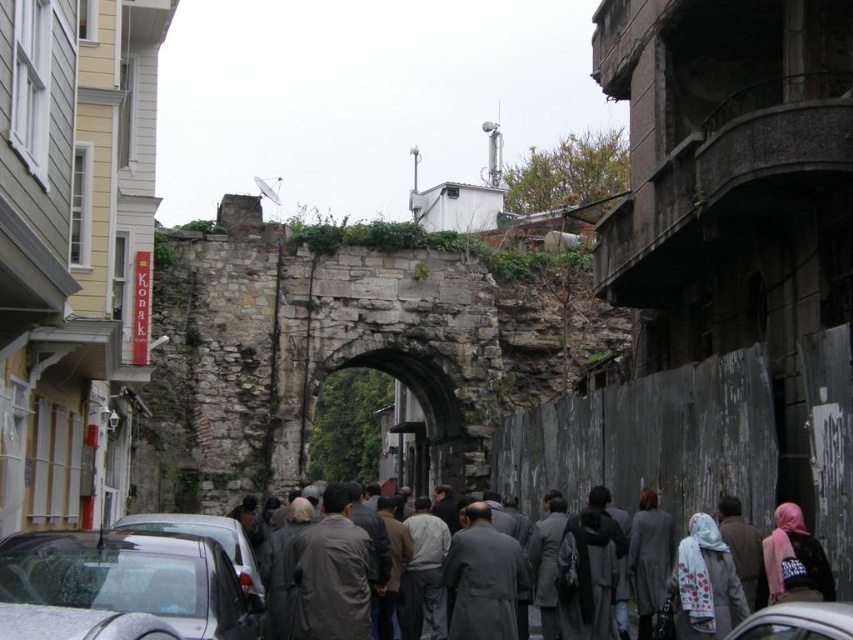
Question: Does white floral scarf at center appear on the right side of pink fabric headscarf at lower right?

Choices:
 (A) no
 (B) yes

Answer: (A)

Question: Which object is the farthest from the white floral scarf at center?

Choices:
 (A) shiny black car at lower left
 (B) pink fabric headscarf at lower right
 (C) metallic gray car at lower left
 (D) white glossy car at lower center

Answer: (C)

Question: Can you confirm if shiny black car at lower left is thinner than white floral scarf at center?

Choices:
 (A) yes
 (B) no

Answer: (B)

Question: Among these objects, which one is nearest to the camera?

Choices:
 (A) white glossy car at lower center
 (B) white floral scarf at center
 (C) metallic gray car at lower left

Answer: (A)

Question: Among these objects, which one is nearest to the camera?

Choices:
 (A) white floral scarf at center
 (B) gray woolen coats at center
 (C) metallic gray car at lower left

Answer: (C)

Question: Is shiny black car at lower left above white floral scarf at center?

Choices:
 (A) no
 (B) yes

Answer: (B)